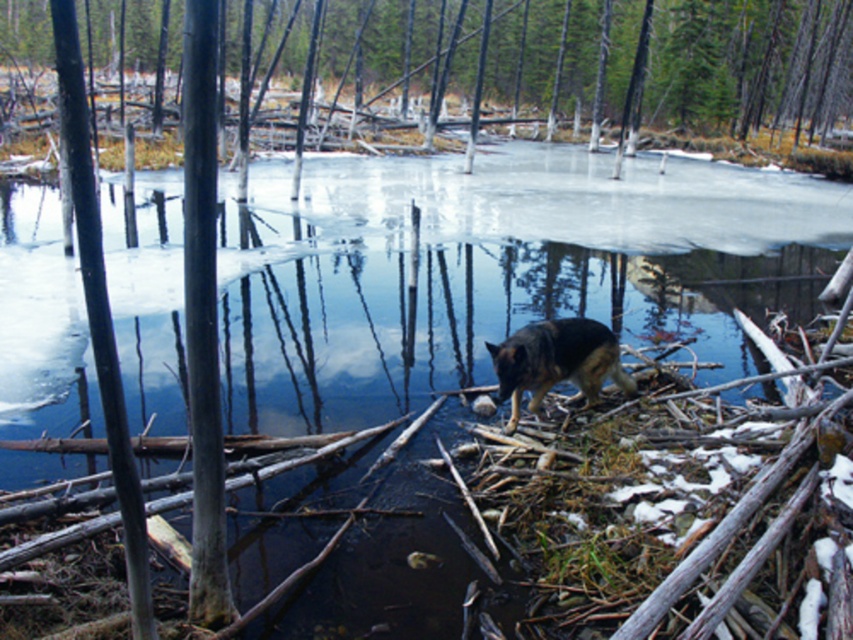
Question: Can you confirm if smooth bark tree at center is wider than dark brown fur dog at center?

Choices:
 (A) yes
 (B) no

Answer: (A)

Question: Does smooth bark tree at center appear on the right side of dark brown fur dog at center?

Choices:
 (A) yes
 (B) no

Answer: (B)

Question: Can you confirm if smooth bark tree at center is positioned to the right of dark brown fur dog at center?

Choices:
 (A) yes
 (B) no

Answer: (B)

Question: Which object is farther from the camera taking this photo?

Choices:
 (A) smooth bark tree at center
 (B) dark brown fur dog at center

Answer: (A)